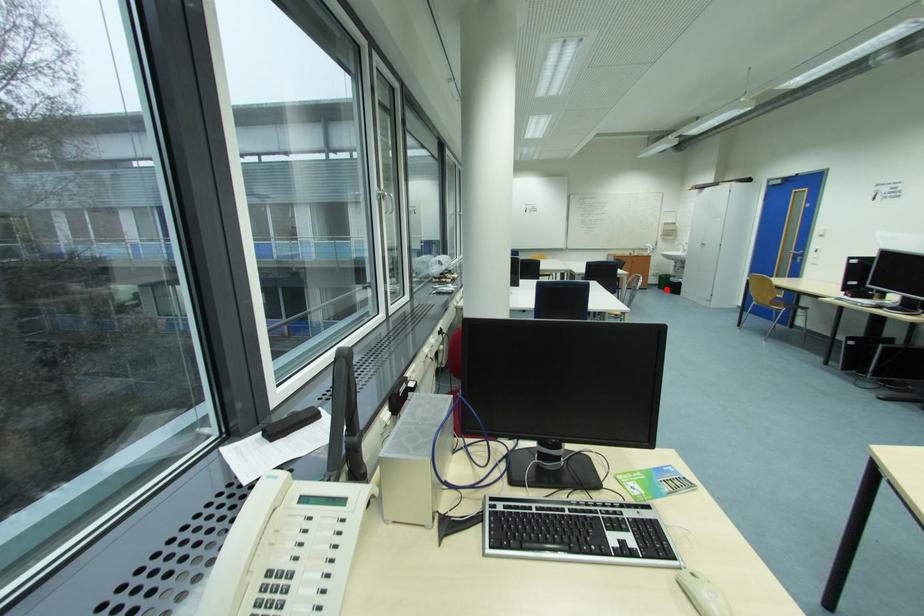
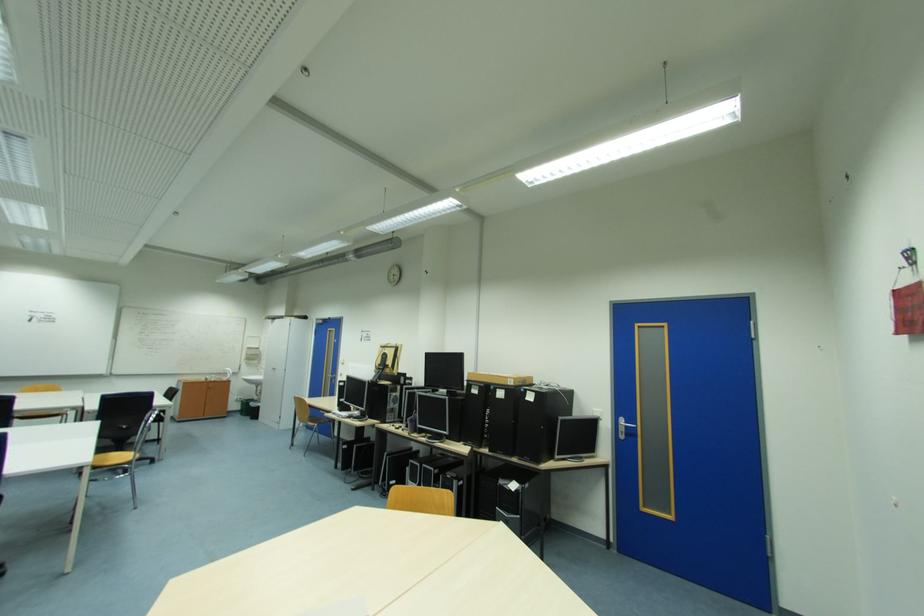
Question: A red point is marked in image1. In image2, is the corresponding 3D point closer to the camera or farther? Reply with the corresponding letter.

Choices:
 (A) The corresponding 3D point is closer.
 (B) The corresponding 3D point is farther.

Answer: (A)